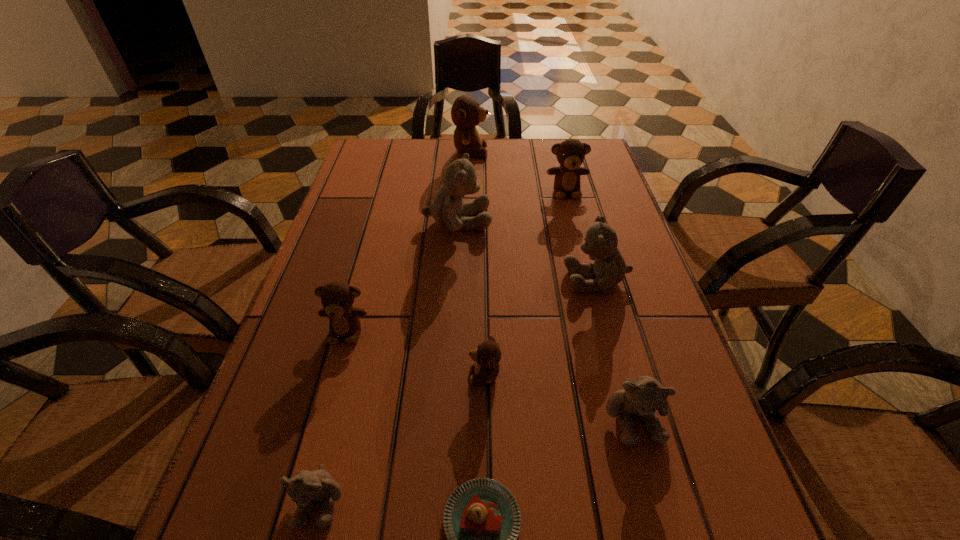
The width and height of the screenshot is (960, 540). I want to click on the second nearest gray teddy bear, so click(641, 397).

Identify the location of the nearest brown teddy bear. (487, 355).

Find the location of a particular element. The width and height of the screenshot is (960, 540). the leftmost gray teddy bear is located at coordinates 305,488.

Image resolution: width=960 pixels, height=540 pixels. I want to click on the smallest gray teddy bear, so coord(305,488).

Where is `free location located 0.050m on the face of the farthest teddy bear`? This screenshot has height=540, width=960. free location located 0.050m on the face of the farthest teddy bear is located at coordinates (503, 152).

Locate an element on the screen. This screenshot has width=960, height=540. free location located on the face of the biggest gray teddy bear is located at coordinates (602, 221).

The width and height of the screenshot is (960, 540). I want to click on vacant space located 0.140m on the face of the rightmost brown teddy bear, so click(576, 231).

I want to click on free spot located on the face of the sixth nearest object, so click(503, 279).

You are a GUI agent. You are given a task and a screenshot of the screen. Output one action in this format:
    pyautogui.click(x=<x>, y=<y>)
    Task: Click on the free space located 0.070m on the face of the sixth nearest object
    
    Given the screenshot: What is the action you would take?
    pyautogui.click(x=534, y=279)

Where is `free space located 0.170m on the face of the sixth nearest object`? free space located 0.170m on the face of the sixth nearest object is located at coordinates (490, 279).